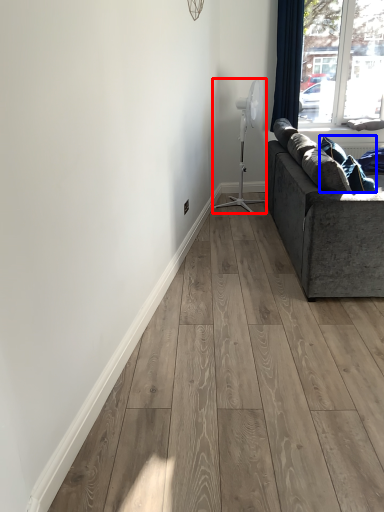
Question: Which object appears farthest to the camera in this image, fan (highlighted by a red box) or pillow (highlighted by a blue box)?

Choices:
 (A) fan
 (B) pillow

Answer: (A)